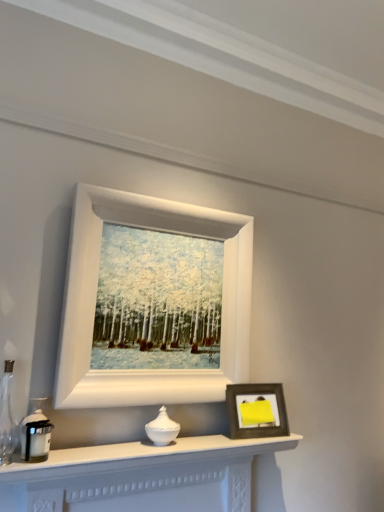
Question: Is matte black candle holder at left, the 1th candle holder in the left-to-right sequence, thinner than wooden photo frame at lower right, which is counted as the second picture frame, starting from the top?

Choices:
 (A) yes
 (B) no

Answer: (B)

Question: From the image's perspective, is matte black candle holder at left, which is the first candle holder in front-to-back order, below wooden photo frame at lower right, the first picture frame in the bottom-to-top sequence?

Choices:
 (A) no
 (B) yes

Answer: (A)

Question: Is matte black candle holder at left, arranged as the second candle holder when viewed from the back, not close to wooden photo frame at lower right, which is counted as the second picture frame, starting from the top?

Choices:
 (A) yes
 (B) no

Answer: (B)

Question: Is matte black candle holder at left, the 1th candle holder in the left-to-right sequence, further to the viewer compared to wooden photo frame at lower right, which is counted as the second picture frame, starting from the top?

Choices:
 (A) yes
 (B) no

Answer: (B)

Question: Is matte black candle holder at left, which is the first candle holder in front-to-back order, taller than wooden photo frame at lower right, which is counted as the second picture frame, starting from the top?

Choices:
 (A) no
 (B) yes

Answer: (A)

Question: In terms of height, does white matte picture frame at upper center, placed as the 2th picture frame when sorted from bottom to top, look taller or shorter compared to white matte fireplace at lower center?

Choices:
 (A) short
 (B) tall

Answer: (B)

Question: Based on their sizes in the image, would you say white matte picture frame at upper center, arranged as the 1th picture frame when viewed from the top, is bigger or smaller than white matte fireplace at lower center?

Choices:
 (A) small
 (B) big

Answer: (B)

Question: From the image's perspective, is white matte picture frame at upper center, arranged as the 1th picture frame when viewed from the top, above or below white matte fireplace at lower center?

Choices:
 (A) above
 (B) below

Answer: (A)

Question: Is point (175, 380) closer or farther from the camera than point (61, 507)?

Choices:
 (A) farther
 (B) closer

Answer: (A)

Question: From the image's perspective, is wooden photo frame at lower right, which is counted as the second picture frame, starting from the top, above or below white matte picture frame at upper center, placed as the 2th picture frame when sorted from bottom to top?

Choices:
 (A) below
 (B) above

Answer: (A)

Question: Based on their positions, is wooden photo frame at lower right, the first picture frame in the bottom-to-top sequence, located to the left or right of white matte picture frame at upper center, arranged as the 1th picture frame when viewed from the top?

Choices:
 (A) left
 (B) right

Answer: (B)

Question: Relative to white matte picture frame at upper center, placed as the 2th picture frame when sorted from bottom to top, is wooden photo frame at lower right, the first picture frame in the bottom-to-top sequence, in front or behind?

Choices:
 (A) front
 (B) behind

Answer: (B)

Question: Is point (235, 404) positioned closer to the camera than point (81, 203)?

Choices:
 (A) farther
 (B) closer

Answer: (A)

Question: From the image's perspective, relative to white matte picture frame at upper center, arranged as the 1th picture frame when viewed from the top, is white glossy vase at center, the first candle holder when ordered from back to front, above or below?

Choices:
 (A) above
 (B) below

Answer: (B)

Question: Is point (162, 443) closer or farther from the camera than point (91, 275)?

Choices:
 (A) farther
 (B) closer

Answer: (B)